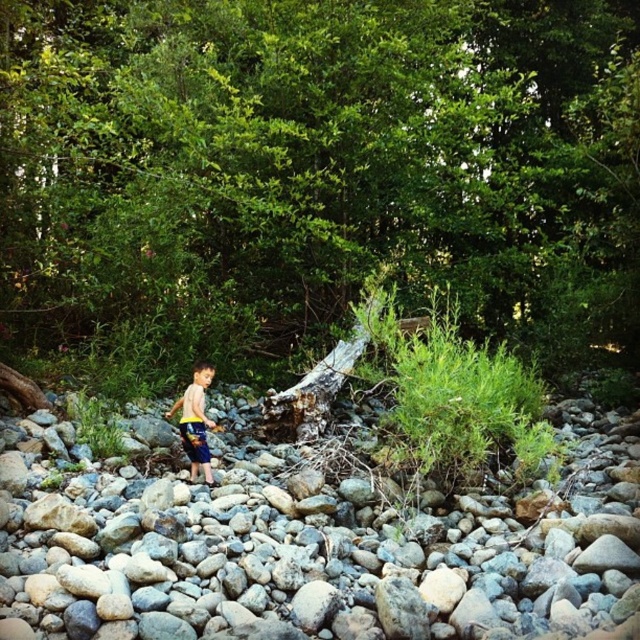
You are a geologist examining the scene. The smooth gray rocks at center are crucial to your study. Where exactly are they positioned in the image coordinates?

The smooth gray rocks at center are located at point 0.845 on the x axis and 0.495 on the y axis.

You are a hiker trying to find smooth gray rocks in a forest area. You see a point marked at coordinates (316, 540). Based on the scene, where should you look to find the smooth gray rocks?

The point marked at coordinates (316, 540) indicates that the smooth gray rocks are located at the center of the scene.